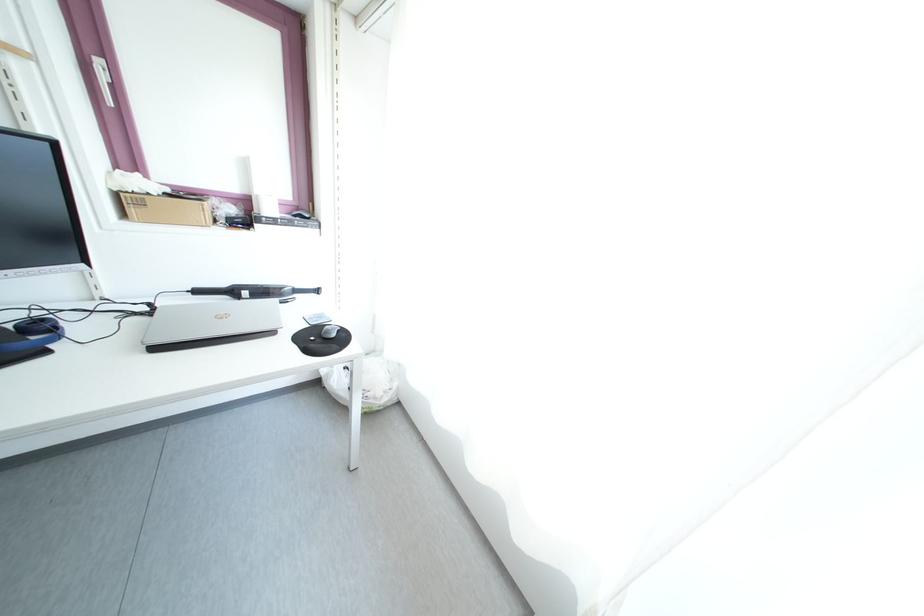
Describe the element at coordinates (103, 79) in the screenshot. The height and width of the screenshot is (616, 924). I see `a white window handle` at that location.